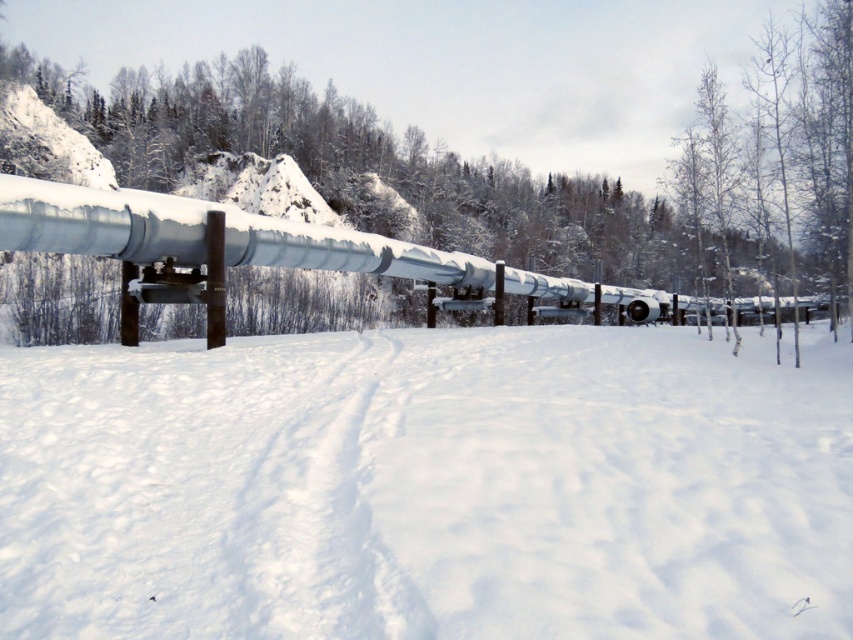
Question: Which object is closer to the camera taking this photo?

Choices:
 (A) white fluffy snow at center
 (B) smooth bark tree at center

Answer: (A)

Question: Does smooth bark tree at center have a greater width compared to sleek metallic pipeline at center?

Choices:
 (A) no
 (B) yes

Answer: (B)

Question: Which point is closer to the camera?

Choices:
 (A) sleek metallic pipeline at center
 (B) smooth bark tree at center
 (C) white fluffy snow at center

Answer: (C)

Question: Is white fluffy snow at center in front of sleek metallic pipeline at center?

Choices:
 (A) no
 (B) yes

Answer: (B)

Question: Can you confirm if smooth bark tree at center is bigger than sleek metallic pipeline at center?

Choices:
 (A) yes
 (B) no

Answer: (A)

Question: Which object is the closest to the sleek metallic pipeline at center?

Choices:
 (A) smooth bark tree at center
 (B) white fluffy snow at center

Answer: (B)